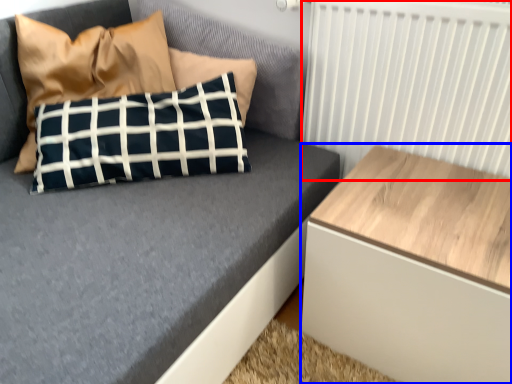
Question: Among these objects, which one is nearest to the camera, radiator (highlighted by a red box) or table (highlighted by a blue box)?

Choices:
 (A) radiator
 (B) table

Answer: (B)